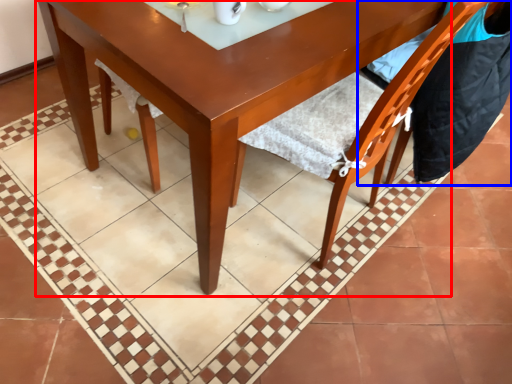
Question: Which point is further to the camera, round table (highlighted by a red box) or chair (highlighted by a blue box)?

Choices:
 (A) round table
 (B) chair

Answer: (B)